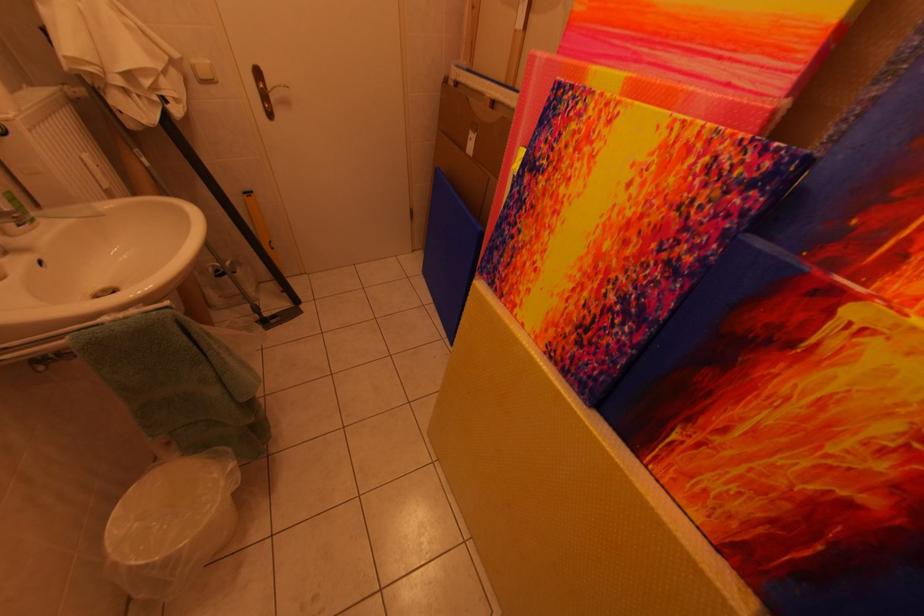
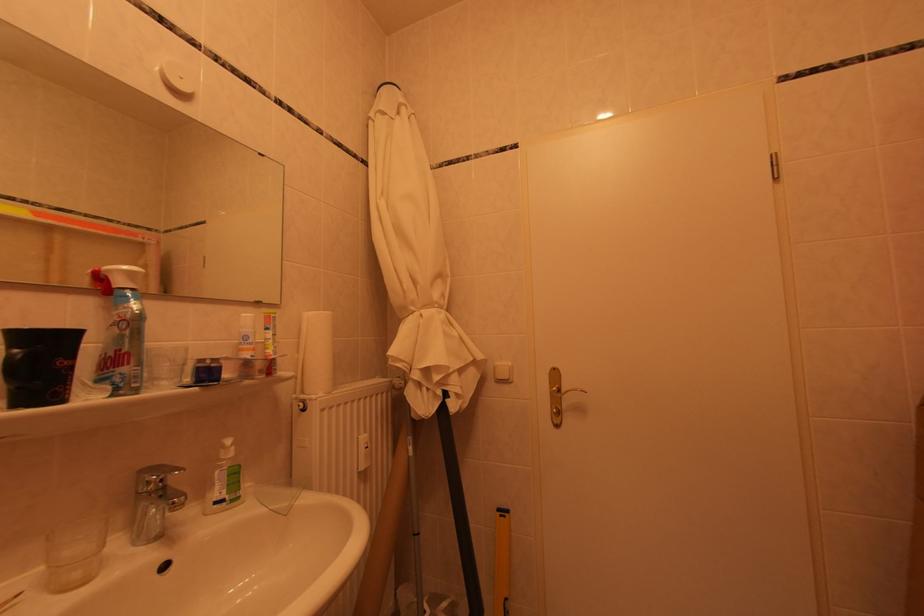
In the second image, find the point that corresponds to point (278, 92) in the first image.

(572, 395)